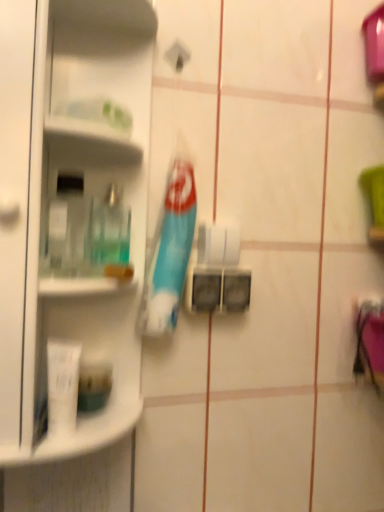
Question: From a real-world perspective, is clear plastic bottle at left on white matte tube at lower left, acting as the first toiletry starting from the front?

Choices:
 (A) yes
 (B) no

Answer: (A)

Question: From a real-world perspective, is clear plastic bottle at left beneath white matte tube at lower left, the second toiletry in the back-to-front sequence?

Choices:
 (A) yes
 (B) no

Answer: (B)

Question: Considering the relative sizes of clear plastic bottle at left and white matte tube at lower left, the second toiletry in the back-to-front sequence, in the image provided, is clear plastic bottle at left taller than white matte tube at lower left, the second toiletry in the back-to-front sequence,?

Choices:
 (A) no
 (B) yes

Answer: (B)

Question: Considering the relative positions of clear plastic bottle at left and white matte tube at lower left, acting as the first toiletry starting from the front, in the image provided, is clear plastic bottle at left to the right of white matte tube at lower left, acting as the first toiletry starting from the front, from the viewer's perspective?

Choices:
 (A) no
 (B) yes

Answer: (A)

Question: Does clear plastic bottle at left have a lesser height compared to white matte tube at lower left, the second toiletry in the back-to-front sequence?

Choices:
 (A) yes
 (B) no

Answer: (B)

Question: Is clear plastic bottle at left positioned far away from white matte tube at lower left, acting as the first toiletry starting from the front?

Choices:
 (A) no
 (B) yes

Answer: (A)

Question: Considering the relative sizes of translucent plastic mouthwash at left and white matte tube at lower left, the second toiletry in the back-to-front sequence, in the image provided, is translucent plastic mouthwash at left bigger than white matte tube at lower left, the second toiletry in the back-to-front sequence,?

Choices:
 (A) no
 (B) yes

Answer: (A)

Question: Are translucent plastic mouthwash at left and white matte tube at lower left, the second toiletry in the back-to-front sequence, making contact?

Choices:
 (A) no
 (B) yes

Answer: (A)

Question: Can you confirm if translucent plastic mouthwash at left is thinner than white matte tube at lower left, acting as the first toiletry starting from the front?

Choices:
 (A) no
 (B) yes

Answer: (A)

Question: Considering the relative sizes of translucent plastic mouthwash at left and white matte tube at lower left, the second toiletry in the back-to-front sequence, in the image provided, is translucent plastic mouthwash at left smaller than white matte tube at lower left, the second toiletry in the back-to-front sequence,?

Choices:
 (A) no
 (B) yes

Answer: (B)

Question: Is the position of translucent plastic mouthwash at left more distant than that of white matte tube at lower left, the second toiletry in the back-to-front sequence?

Choices:
 (A) no
 (B) yes

Answer: (B)

Question: Would you say translucent plastic mouthwash at left is outside white matte tube at lower left, acting as the first toiletry starting from the front?

Choices:
 (A) no
 (B) yes

Answer: (B)

Question: From the image's perspective, is white matte toilet paper at center below blue plastic toothbrush at center?

Choices:
 (A) yes
 (B) no

Answer: (A)